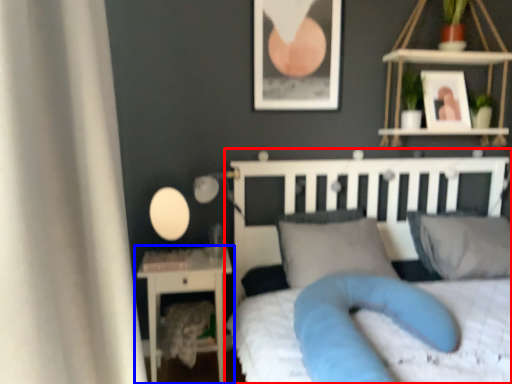
Question: Which point is further to the camera, bed (highlighted by a red box) or nightstand (highlighted by a blue box)?

Choices:
 (A) bed
 (B) nightstand

Answer: (B)